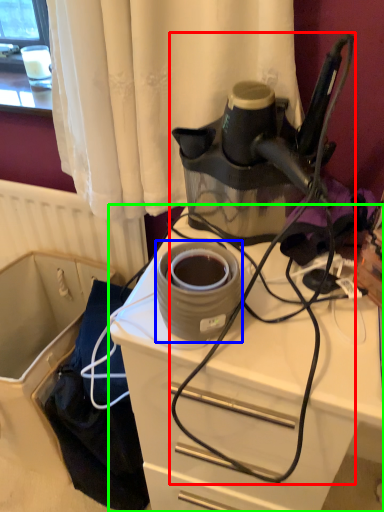
Question: Which is nearer to the wire (highlighted by a red box)? appliance (highlighted by a blue box) or desk (highlighted by a green box).

Choices:
 (A) appliance
 (B) desk

Answer: (B)